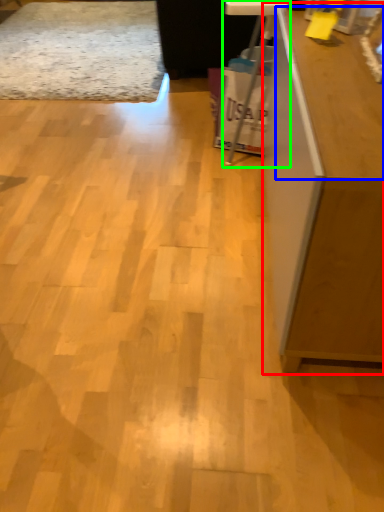
Question: Considering the real-world distances, which object is closest to furniture (highlighted by a red box)? counter top (highlighted by a blue box) or computer desk (highlighted by a green box).

Choices:
 (A) counter top
 (B) computer desk

Answer: (A)